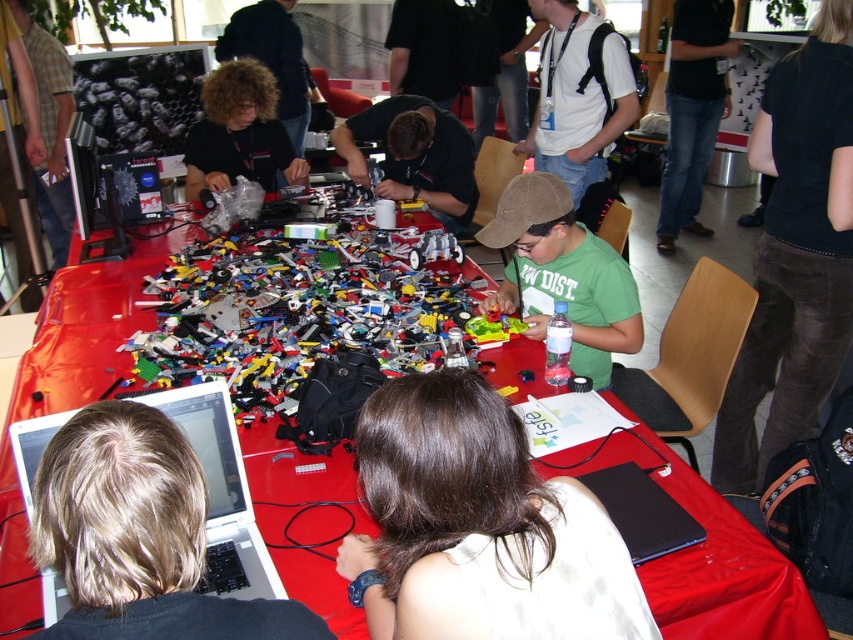
Question: Does white t-shirt at center appear over dark brown shirt at center?

Choices:
 (A) yes
 (B) no

Answer: (A)

Question: Which object appears closest to the camera in this image?

Choices:
 (A) black matte shirt at upper center
 (B) black matte laptop at lower center
 (C) red plastic table at center

Answer: (B)

Question: Which of the following is the closest to the observer?

Choices:
 (A) (440, 282)
 (B) (837, 4)

Answer: (B)

Question: Which is farther from the black matte shirt at upper center?

Choices:
 (A) black corduroy pants at lower right
 (B) white plastic laptop at lower left
 (C) black matte laptop at lower center
 (D) plastic lego pieces at center

Answer: (C)

Question: Is brown hair at center below black matte laptop at lower center?

Choices:
 (A) yes
 (B) no

Answer: (B)

Question: Is white plastic laptop at lower left in front of black shirt at upper center?

Choices:
 (A) no
 (B) yes

Answer: (B)